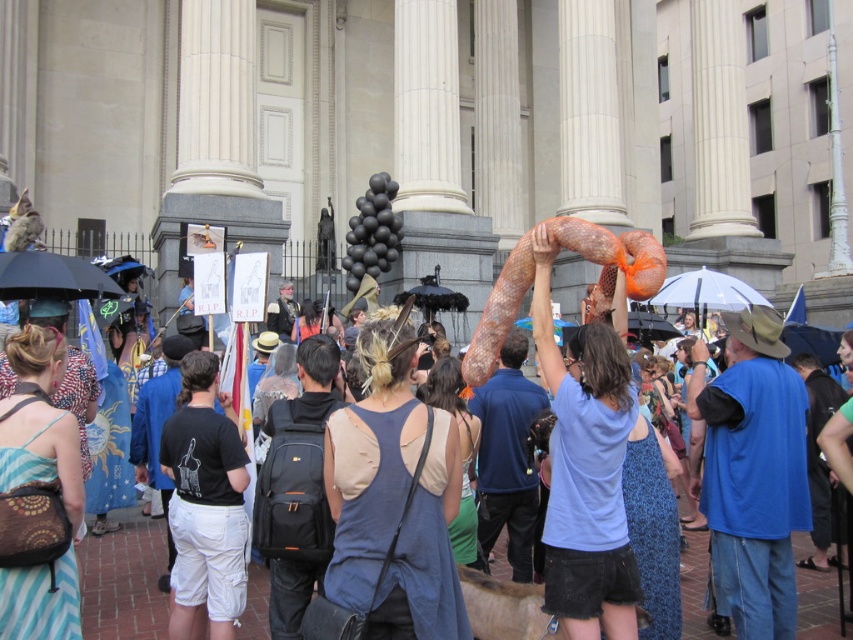
You are a photographer trying to capture a clear shot of the light blue cotton shirt at upper center and the transparent plastic umbrella at upper center. Since the shirt and umbrella are both at the same height, which object would appear smaller in your photo?

The light blue cotton shirt at upper center appears smaller in the photo because it has a smaller size compared to the transparent plastic umbrella at upper center.

You are a photographer who wants to capture a closeup of the large orange netted object held by the person on the right side of the frame. You are currently standing at point (x=585, y=468) on the light blue cotton shirt at upper center. Can you determine if you are facing the right direction to take the photo?

The point (x=585, y=468) is on the light blue cotton shirt at upper center, so if you are standing there, you are facing towards the right side of the frame where the person with the large orange netted object is located. Therefore, you are facing the correct direction to take the photo.

You are a photographer trying to capture a clear shot of the transparent plastic umbrella at upper center without the black matte umbrella at left blocking it. Based on their heights, which umbrella should you focus on to avoid obstruction?

The transparent plastic umbrella at upper center is taller than the black matte umbrella at left. Therefore, focusing on the transparent plastic umbrella at upper center would be less likely to be blocked since it is taller and might be positioned above the shorter black matte umbrella at left.